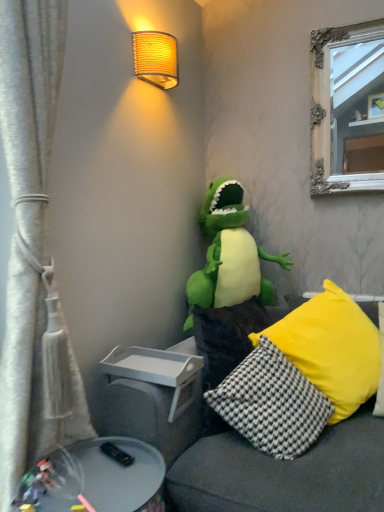
Question: From a real-world perspective, relative to soft gray couch at center, is metallic gray tray at lower left vertically above or below?

Choices:
 (A) above
 (B) below

Answer: (B)

Question: Considering the positions of point (130, 478) and point (339, 385), is point (130, 478) closer or farther from the camera than point (339, 385)?

Choices:
 (A) farther
 (B) closer

Answer: (B)

Question: Based on their relative distances, which object is nearer to the black-and-white checkered pillow at lower right, which is the 2th pillow in right-to-left order?

Choices:
 (A) yellow fabric pillow at right, the first pillow in the right-to-left sequence
 (B) green plush toy at center
 (C) yellow textured pillow at center, positioned as the third pillow in right-to-left order
 (D) woven fabric lampshade at upper center
 (E) soft gray couch at center

Answer: (E)

Question: Estimate the real-world distances between objects in this image. Which object is closer to the woven fabric lampshade at upper center?

Choices:
 (A) black-and-white checkered pillow at lower right, the 2th pillow when ordered from left to right
 (B) yellow textured pillow at center, the 1th pillow viewed from the left
 (C) green plush toy at center
 (D) yellow fabric pillow at right, the first pillow in the right-to-left sequence
 (E) soft gray couch at center

Answer: (C)